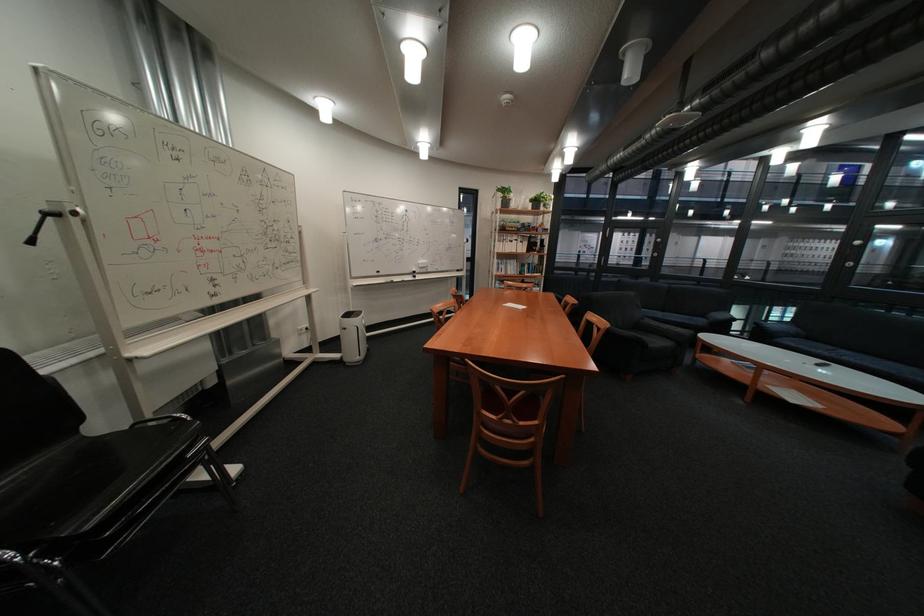
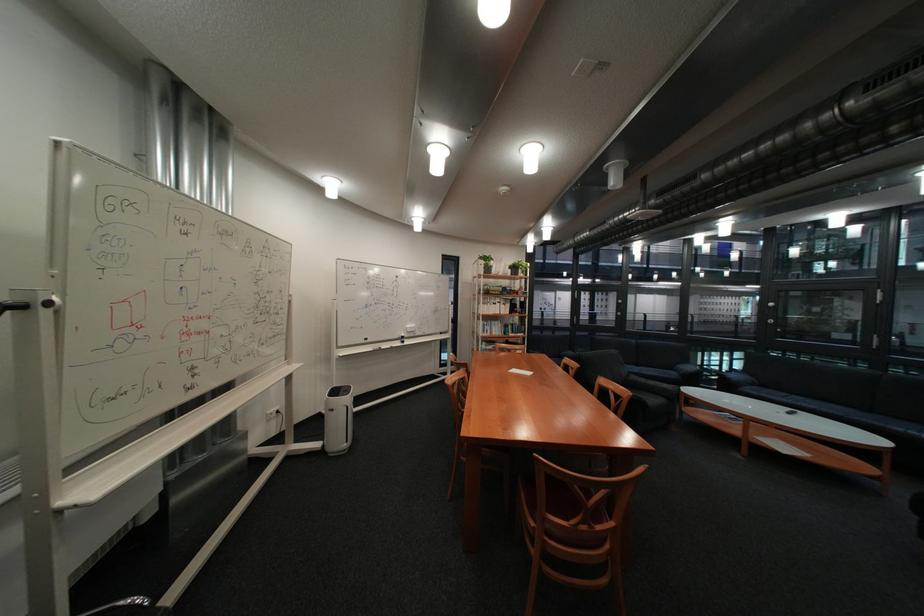
Question: How did the camera likely rotate?

Choices:
 (A) Left
 (B) Right
 (C) Up
 (D) Down

Answer: (C)